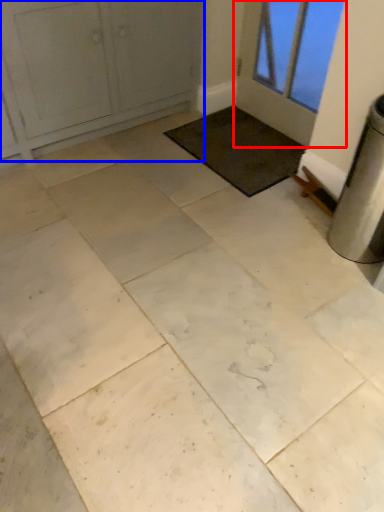
Question: Which object appears closest to the camera in this image, door (highlighted by a red box) or door (highlighted by a blue box)?

Choices:
 (A) door
 (B) door

Answer: (B)